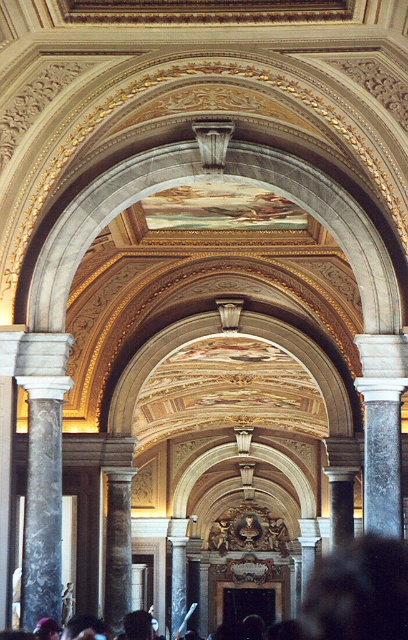
From the picture: Does marble column at left appear on the left side of dark hair at center?

Indeed, marble column at left is positioned on the left side of dark hair at center.

Which is in front, point (44, 557) or point (370, 580)?

Point (44, 557) is in front.

Is point (35, 426) less distant than point (374, 608)?

Yes, point (35, 426) is closer to viewer.

Locate an element on the screen. This screenshot has height=640, width=408. marble column at left is located at coordinates (42, 468).

Which is behind, point (374, 596) or point (177, 605)?

The point (177, 605) is more distant.

Is point (399, 580) positioned after point (175, 586)?

No.

Identify the location of dark hair at center. (359, 593).

Is marble column at left positioned behind marble column at center?

No.

Can you confirm if marble column at left is positioned above marble column at center?

Yes, marble column at left is above marble column at center.

The width and height of the screenshot is (408, 640). In order to click on marble column at left in this screenshot , I will do `click(42, 468)`.